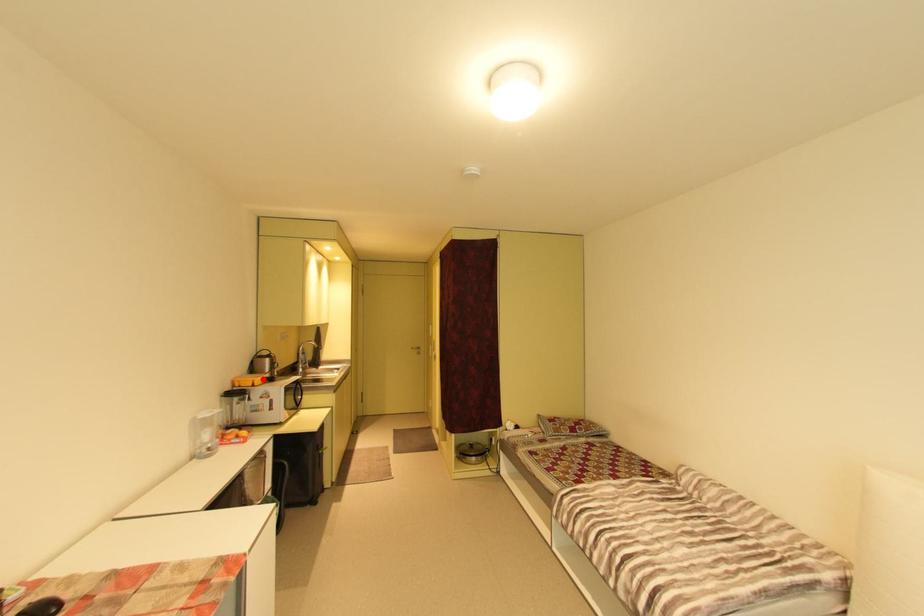
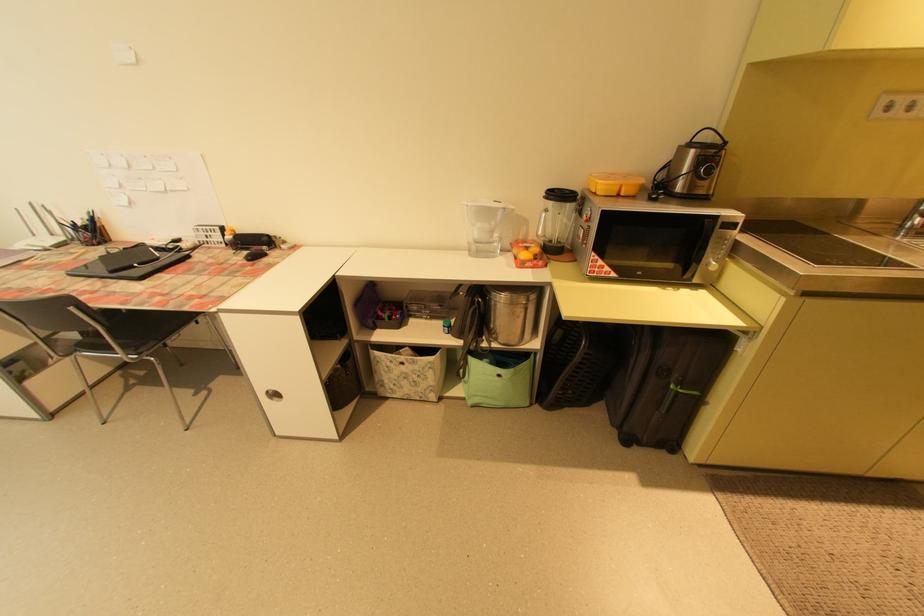
The point at the highlighted location is marked in the first image. Where is the corresponding point in the second image?

(610, 182)